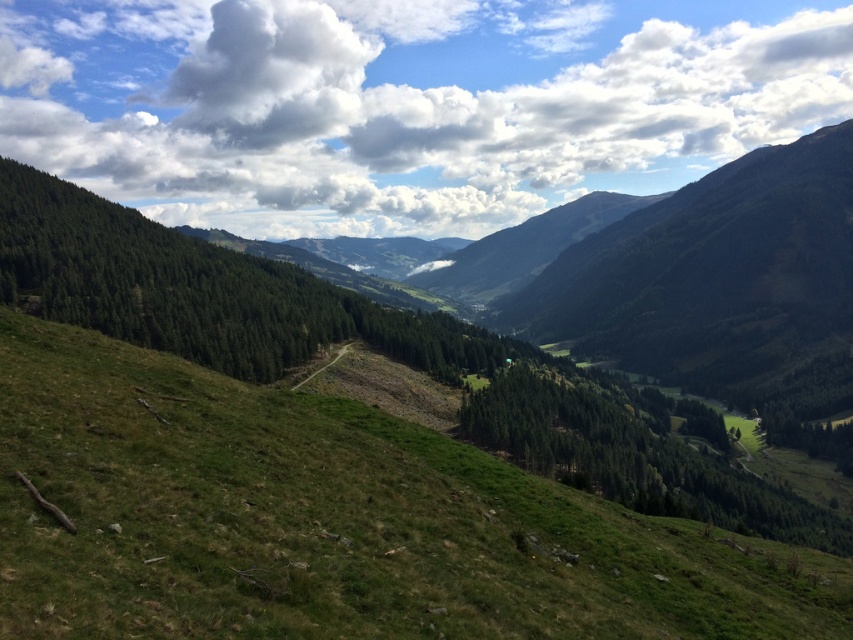
You are standing at the point with coordinates point (170, 128) and want to reach the point with coordinates point (299, 481). According to the image, which direction should you move to get closer to your destination?

You should move forward because point (299, 481) is in front of point (170, 128).

You are a hiker standing at the base of the mountain and see the green grassy slope at lower left and the white fluffy cloud at upper center. Which object is closer to you?

The green grassy slope at lower left is closer to you because it is positioned under the white fluffy cloud at upper center, indicating it is lower in elevation.

Looking at the mountain landscape, which object takes up more area in the image between the green grassy slope at lower left and the white fluffy cloud at upper center?

The white fluffy cloud at upper center occupies more area than the green grassy slope at lower left in the image.